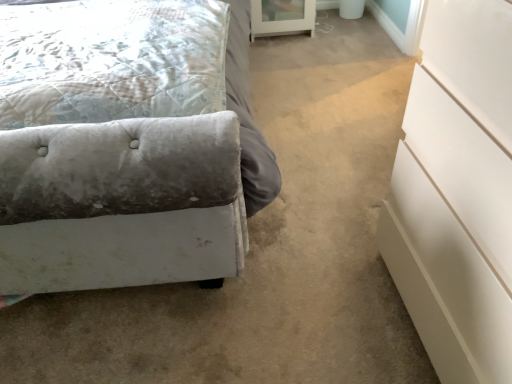
The height and width of the screenshot is (384, 512). What are the coordinates of `white glossy chest of drawers at right` in the screenshot? It's located at (457, 193).

The width and height of the screenshot is (512, 384). What are the coordinates of `white glass cabinet at upper center` in the screenshot? It's located at (x=282, y=17).

Find the location of `velvet tufted pillow at left`. velvet tufted pillow at left is located at coordinates (111, 60).

The image size is (512, 384). Identify the location of white glossy chest of drawers at right. (457, 193).

Can you confirm if velvet tufted pillow at left is taller than white glossy chest of drawers at right?

No.

Does velvet tufted pillow at left have a smaller size compared to white glossy chest of drawers at right?

Yes.

Which of these two, velvet tufted pillow at left or white glossy chest of drawers at right, is wider?

Wider between the two is velvet tufted pillow at left.

Looking at this image, from a real-world perspective, is velvet tufted pillow at left on top of white glossy chest of drawers at right?

Yes, from a real-world perspective, velvet tufted pillow at left is on top of white glossy chest of drawers at right.

At what (x,y) coordinates should I click in order to perform the action: click on pillow located on the left of white glass cabinet at upper center. Please return your answer as a coordinate pair (x, y). The width and height of the screenshot is (512, 384). Looking at the image, I should click on (111, 60).

Based on the photo, would you say white glass cabinet at upper center is outside velvet tufted pillow at left?

That's correct, white glass cabinet at upper center is outside of velvet tufted pillow at left.

Considering the positions of objects white glass cabinet at upper center and velvet tufted pillow at left in the image provided, who is behind, white glass cabinet at upper center or velvet tufted pillow at left?

white glass cabinet at upper center is behind.

From a real-world perspective, is white glass cabinet at upper center located beneath velvet tufted pillow at left?

Yes, from a real-world perspective, white glass cabinet at upper center is below velvet tufted pillow at left.

Considering the sizes of objects velvet tufted pillow at left and white glass cabinet at upper center in the image provided, who is bigger, velvet tufted pillow at left or white glass cabinet at upper center?

With larger size is velvet tufted pillow at left.

Considering the relative positions of velvet tufted pillow at left and white glass cabinet at upper center in the image provided, is velvet tufted pillow at left to the right of white glass cabinet at upper center from the viewer's perspective?

In fact, velvet tufted pillow at left is to the left of white glass cabinet at upper center.

Is the surface of velvet tufted pillow at left in direct contact with white glass cabinet at upper center?

No, velvet tufted pillow at left is not making contact with white glass cabinet at upper center.

From the image's perspective, which one is positioned higher, velvet tufted pillow at left or white glass cabinet at upper center?

white glass cabinet at upper center is shown above in the image.

Is there a large distance between white glass cabinet at upper center and white glossy chest of drawers at right?

Indeed, white glass cabinet at upper center is not near white glossy chest of drawers at right.

Who is bigger, white glass cabinet at upper center or white glossy chest of drawers at right?

With larger size is white glossy chest of drawers at right.

Can you confirm if white glass cabinet at upper center is shorter than white glossy chest of drawers at right?

Yes, white glass cabinet at upper center is shorter than white glossy chest of drawers at right.

Is white glass cabinet at upper center looking in the opposite direction of white glossy chest of drawers at right?

No, white glass cabinet at upper center is not facing the opposite direction of white glossy chest of drawers at right.

Does white glossy chest of drawers at right have a larger size compared to velvet gray bed at lower left?

Incorrect, white glossy chest of drawers at right is not larger than velvet gray bed at lower left.

Where is `the chest of drawers below the velvet gray bed at lower left (from a real-world perspective)`? Image resolution: width=512 pixels, height=384 pixels. the chest of drawers below the velvet gray bed at lower left (from a real-world perspective) is located at coordinates (457, 193).

From the picture: Is white glossy chest of drawers at right positioned with its back to velvet gray bed at lower left?

No.

Which of these two, white glossy chest of drawers at right or velvet gray bed at lower left, is wider?

Wider between the two is velvet gray bed at lower left.

Are velvet gray bed at lower left and white glossy chest of drawers at right beside each other?

No.

Based on the photo, between velvet gray bed at lower left and white glossy chest of drawers at right, which one has larger width?

With larger width is velvet gray bed at lower left.

Is velvet gray bed at lower left to the left of white glossy chest of drawers at right from the viewer's perspective?

Indeed, velvet gray bed at lower left is positioned on the left side of white glossy chest of drawers at right.

How far apart are white glossy chest of drawers at right and velvet tufted pillow at left?

31.09 inches.

Is white glossy chest of drawers at right facing towards velvet tufted pillow at left?

No, white glossy chest of drawers at right does not turn towards velvet tufted pillow at left.

In the scene shown: Would you say white glossy chest of drawers at right contains velvet tufted pillow at left?

No, velvet tufted pillow at left is not inside white glossy chest of drawers at right.

From the image's perspective, who appears lower, white glossy chest of drawers at right or velvet tufted pillow at left?

white glossy chest of drawers at right appears lower in the image.

The height and width of the screenshot is (384, 512). I want to click on the chest of drawers beneath the velvet tufted pillow at left (from a real-world perspective), so click(x=457, y=193).

I want to click on pillow above the white glass cabinet at upper center (from a real-world perspective), so coord(111,60).

When comparing their distances from white glass cabinet at upper center, does velvet tufted pillow at left or white glossy chest of drawers at right seem further?

Based on the image, white glossy chest of drawers at right appears to be further to white glass cabinet at upper center.

From the image, which object appears to be farther from velvet tufted pillow at left, white glossy chest of drawers at right or velvet gray bed at lower left?

white glossy chest of drawers at right is further to velvet tufted pillow at left.

Estimate the real-world distances between objects in this image. Which object is further from velvet tufted pillow at left, white glass cabinet at upper center or velvet gray bed at lower left?

white glass cabinet at upper center is further to velvet tufted pillow at left.

Consider the image. From the image, which object appears to be nearer to white glossy chest of drawers at right, velvet tufted pillow at left or white glass cabinet at upper center?

The object closer to white glossy chest of drawers at right is velvet tufted pillow at left.

Estimate the real-world distances between objects in this image. Which object is closer to white glass cabinet at upper center, white glossy chest of drawers at right or velvet tufted pillow at left?

velvet tufted pillow at left is closer to white glass cabinet at upper center.

When comparing their distances from velvet tufted pillow at left, does velvet gray bed at lower left or white glass cabinet at upper center seem closer?

The object closer to velvet tufted pillow at left is velvet gray bed at lower left.

When comparing their distances from white glass cabinet at upper center, does velvet gray bed at lower left or velvet tufted pillow at left seem closer?

velvet gray bed at lower left is positioned closer to the anchor white glass cabinet at upper center.

Looking at the image, which one is located closer to velvet tufted pillow at left, velvet gray bed at lower left or white glossy chest of drawers at right?

The object closer to velvet tufted pillow at left is velvet gray bed at lower left.

This screenshot has height=384, width=512. I want to click on bed between white glossy chest of drawers at right and white glass cabinet at upper center from front to back, so click(x=248, y=114).

Locate an element on the screen. The image size is (512, 384). pillow positioned between velvet gray bed at lower left and white glass cabinet at upper center from near to far is located at coordinates (111, 60).

Locate an element on the screen. Image resolution: width=512 pixels, height=384 pixels. pillow between white glossy chest of drawers at right and white glass cabinet at upper center from front to back is located at coordinates (111, 60).

This screenshot has height=384, width=512. Find the location of `pillow located between velvet gray bed at lower left and white glossy chest of drawers at right in the left-right direction`. pillow located between velvet gray bed at lower left and white glossy chest of drawers at right in the left-right direction is located at coordinates (111, 60).